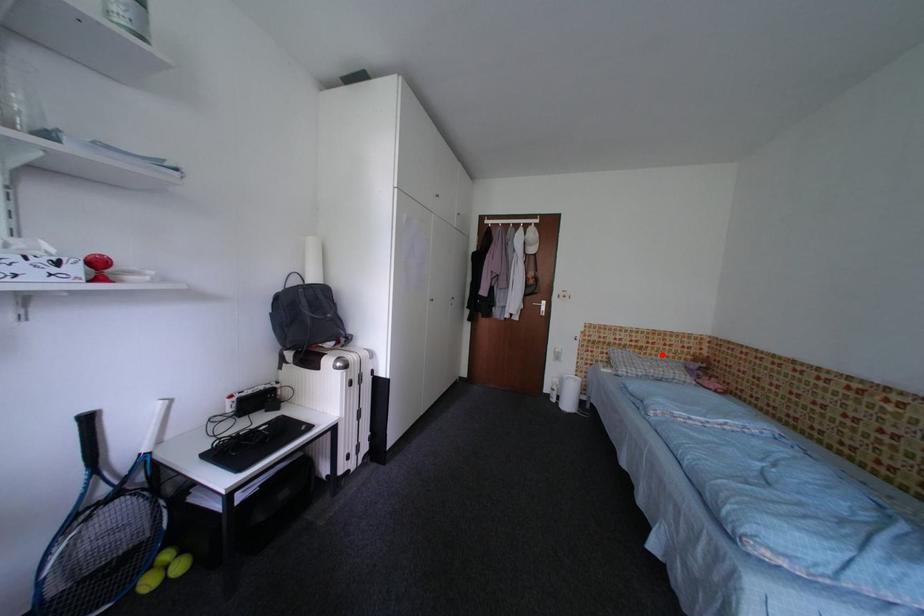
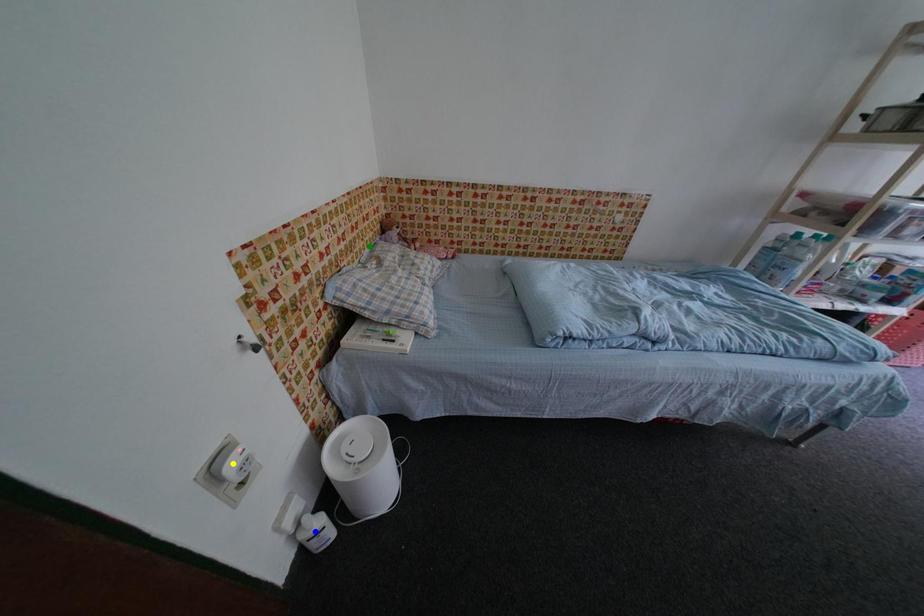
Question: I am providing you with two images of the same scene from different viewpoints. A red point is marked on the first image. You are given multiple points on the second image. Can you choose the point in image 2 that corresponds to the point in image 1?

Choices:
 (A) yellow point
 (B) blue point
 (C) green point

Answer: (C)